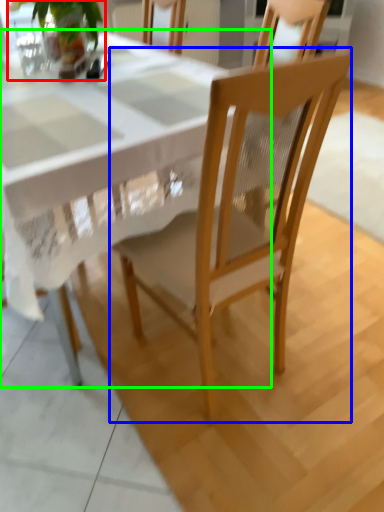
Question: Estimate the real-world distances between objects in this image. Which object is farther from houseplant (highlighted by a red box), chair (highlighted by a blue box) or round table (highlighted by a green box)?

Choices:
 (A) chair
 (B) round table

Answer: (A)